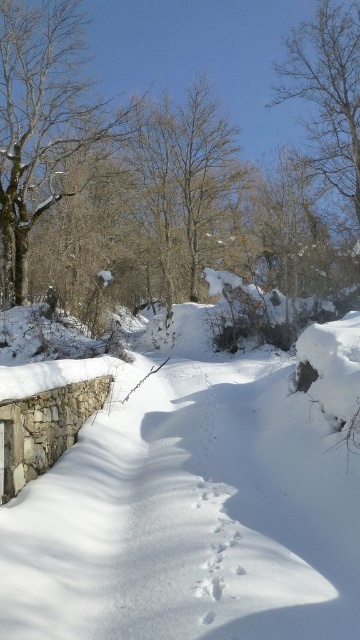
Based on the photo, you are a hiker trying to follow the path in the winter scene. You notice the white powdery snow at center and the brown textured tree at center. Which object is closer to the ground?

The white powdery snow at center is below brown textured tree at center, so the white powdery snow at center is closer to the ground.

You are standing at the starting point of the path in the winter scene. There is a point marked at coordinates [169,172]. Which object in the scene does this point belong to?

The point at coordinates [169,172] is on the brown textured tree at center.